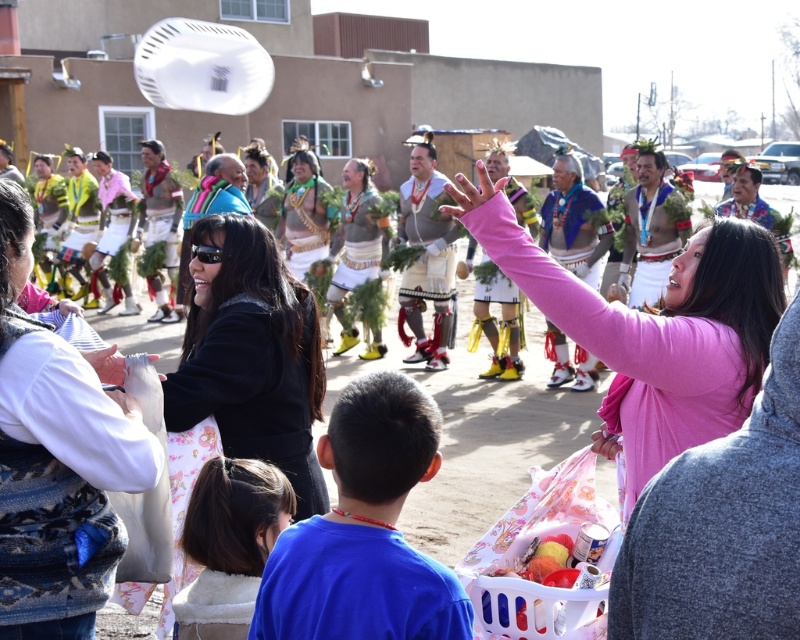
Question: Can you confirm if pink matte shirt at center is positioned below white fluffy blanket at lower left?

Choices:
 (A) no
 (B) yes

Answer: (A)

Question: Is pink matte shirt at center positioned at the back of white woven fabric at center?

Choices:
 (A) yes
 (B) no

Answer: (B)

Question: Which point is farther from the camera taking this photo?

Choices:
 (A) (29, 355)
 (B) (770, 330)
 (C) (232, 324)

Answer: (C)

Question: Which is farther from the pink matte shirt at upper right?

Choices:
 (A) matte white headdress at center
 (B) dark brown hair at lower left

Answer: (A)

Question: Does black matte jacket at center appear on the right side of blue fabric shirt at lower center?

Choices:
 (A) yes
 (B) no

Answer: (B)

Question: Which point is closer to the camera?

Choices:
 (A) dark brown hair at lower left
 (B) pink matte shirt at upper right
 (C) pink matte shirt at center
 (D) white woven blanket at upper left

Answer: (B)